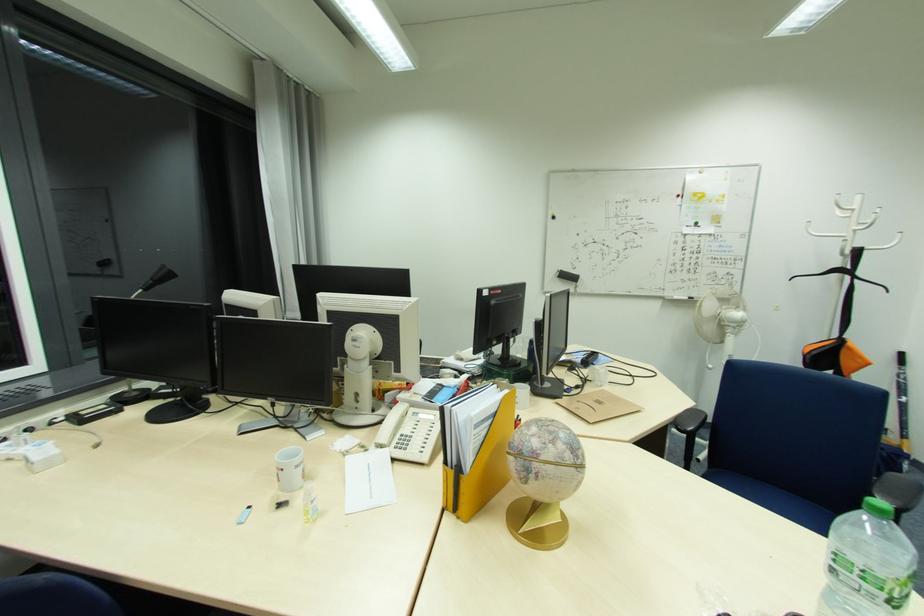
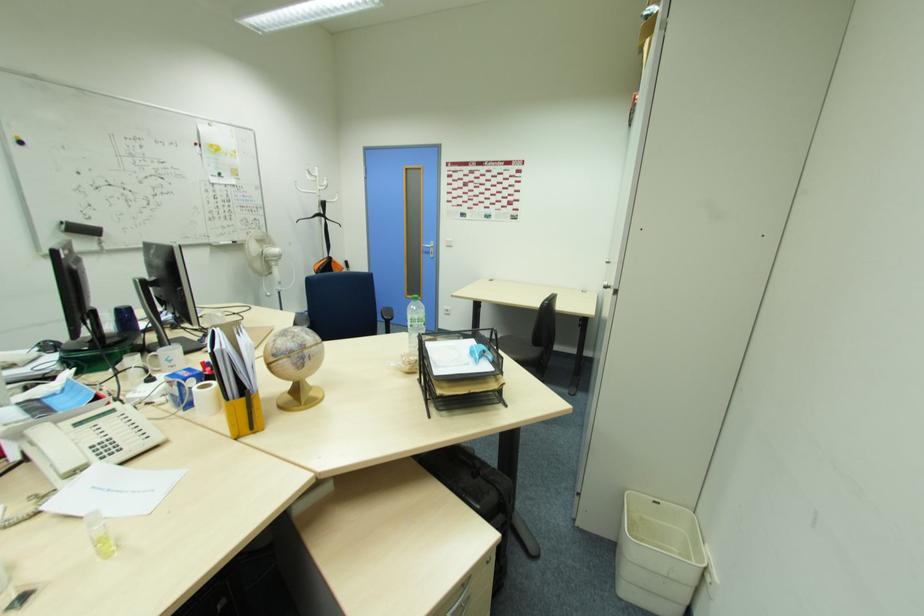
Locate, in the second image, the point that corresponds to (x=858, y=570) in the first image.

(419, 322)